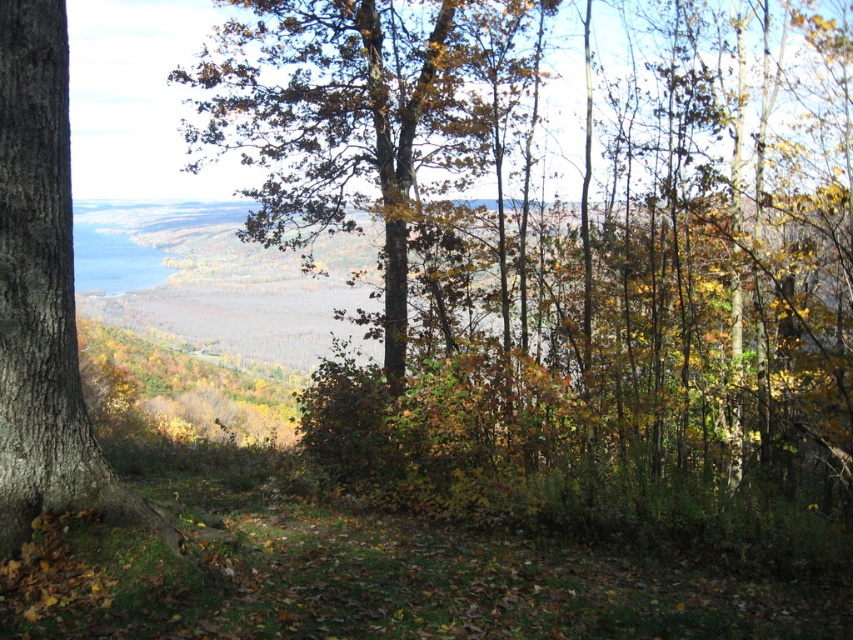
Does brown textured tree at center have a greater width compared to brown rough tree trunk at left?

Correct, the width of brown textured tree at center exceeds that of brown rough tree trunk at left.

Is point (312, 140) less distant than point (32, 214)?

No, it is behind (32, 214).

Is point (238, 36) more distant than point (18, 17)?

That is True.

At what (x,y) coordinates should I click in order to perform the action: click on brown textured tree at center. Please return your answer as a coordinate pair (x, y). Image resolution: width=853 pixels, height=640 pixels. Looking at the image, I should click on (341, 120).